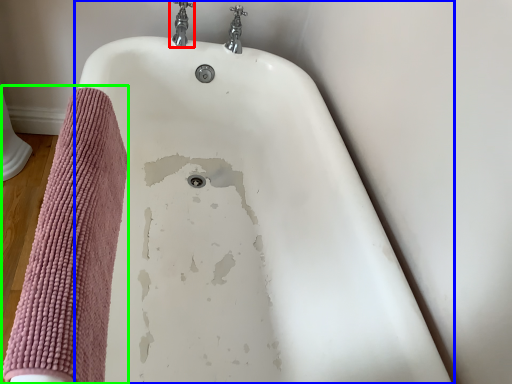
Question: Which is nearer to the tap (highlighted by a red box)? bathtub (highlighted by a blue box) or bath towel (highlighted by a green box).

Choices:
 (A) bathtub
 (B) bath towel

Answer: (A)